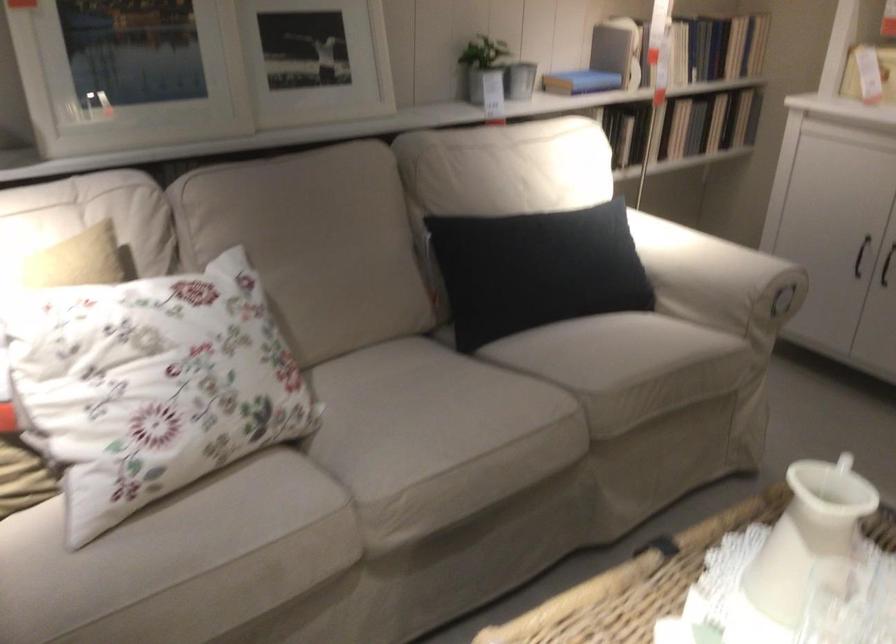
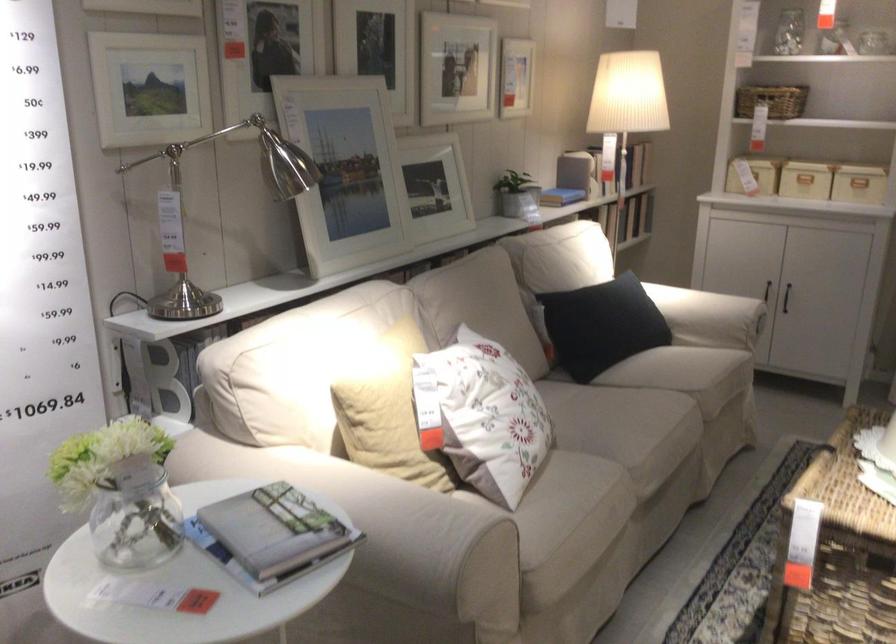
In the second image, find the point that corresponds to [506,278] in the first image.

(600, 325)